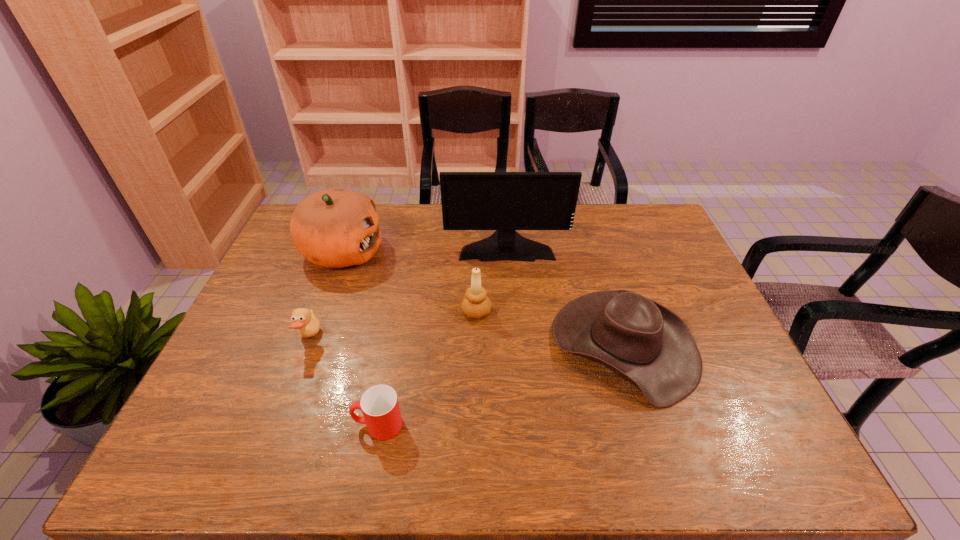
The image size is (960, 540). What are the coordinates of `object present at the far left corner` in the screenshot? It's located at (333, 228).

Image resolution: width=960 pixels, height=540 pixels. In order to click on blank space at the far edge of the desktop in this screenshot , I will do `click(616, 241)`.

In the image, there is a desktop. Where is `free space at the near edge`? This screenshot has width=960, height=540. free space at the near edge is located at coordinates (567, 451).

Find the location of `vacant space at the left edge`. vacant space at the left edge is located at coordinates (296, 272).

Find the location of `blank space at the right edge of the desktop`. blank space at the right edge of the desktop is located at coordinates (678, 258).

Where is `unoccupied area between the second tallest object and the monitor`? unoccupied area between the second tallest object and the monitor is located at coordinates (424, 248).

You are a GUI agent. You are given a task and a screenshot of the screen. Output one action in this format:
    pyautogui.click(x=<x>, y=<y>)
    Task: Click on the free space between the nearest object and the cowboy hat
    The width and height of the screenshot is (960, 540).
    Given the screenshot: What is the action you would take?
    pyautogui.click(x=501, y=385)

The width and height of the screenshot is (960, 540). In order to click on free space between the fourth shortest object and the tallest object in this screenshot , I will do `click(492, 278)`.

The image size is (960, 540). Identify the location of free space between the cowboy hat and the monitor. (565, 295).

This screenshot has height=540, width=960. Identify the location of unoccupied area between the monitor and the candle_holder. (492, 278).